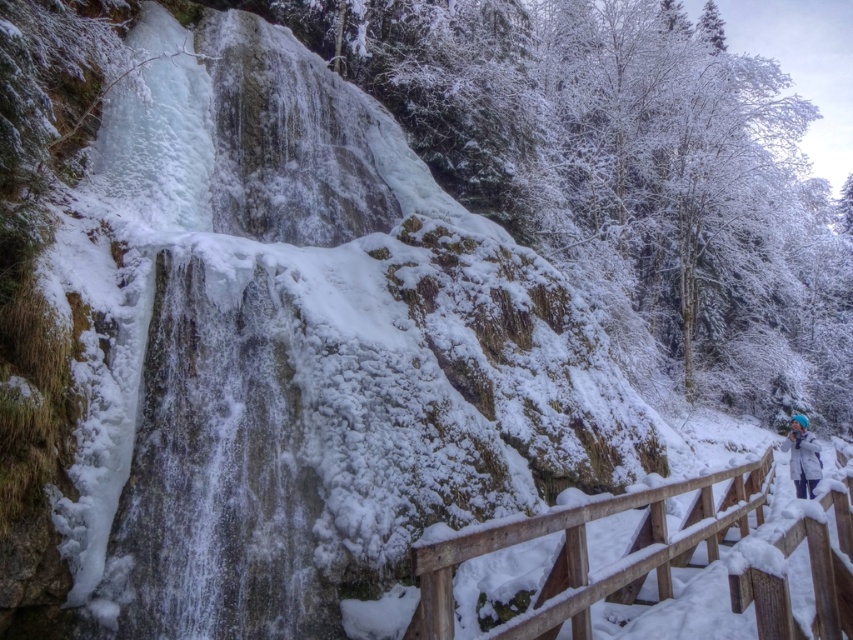
Looking at this image, who is positioned more to the left, wooden rail at lower right or white fleece jacket at lower right?

wooden rail at lower right is more to the left.

Does wooden rail at lower right come in front of white fleece jacket at lower right?

That is True.

Identify the location of wooden rail at lower right. The image size is (853, 640). (585, 552).

Where is `wooden rail at lower right`? wooden rail at lower right is located at coordinates (585, 552).